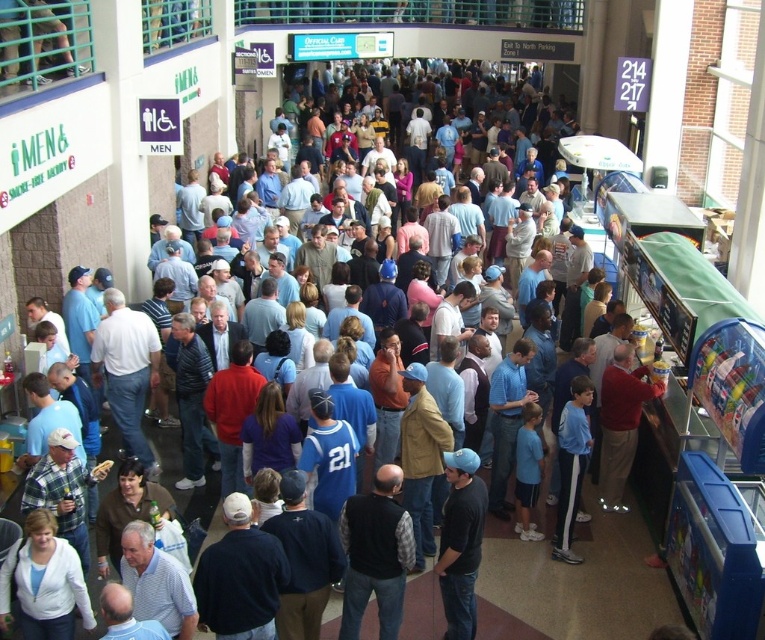
You are standing in the sports venue concourse and see a black vest at center and a black matte baseball cap at center. Which item is positioned to the left of the other?

The black vest at center is to the left of the black matte baseball cap at center.